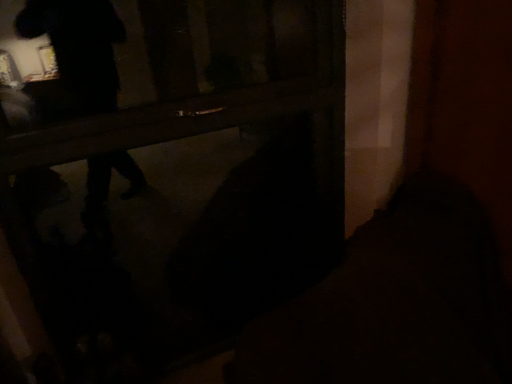
Question: From a real-world perspective, is wooden door at center on black matte bag at lower center?

Choices:
 (A) no
 (B) yes

Answer: (B)

Question: Is wooden door at center positioned with its back to black matte bag at lower center?

Choices:
 (A) no
 (B) yes

Answer: (B)

Question: Is wooden door at center facing towards black matte bag at lower center?

Choices:
 (A) no
 (B) yes

Answer: (B)

Question: From the image's perspective, does wooden door at center appear lower than black matte bag at lower center?

Choices:
 (A) yes
 (B) no

Answer: (B)

Question: Considering the relative sizes of wooden door at center and black matte bag at lower center in the image provided, is wooden door at center smaller than black matte bag at lower center?

Choices:
 (A) no
 (B) yes

Answer: (B)

Question: Does wooden door at center lie in front of black matte bag at lower center?

Choices:
 (A) yes
 (B) no

Answer: (B)

Question: Does black matte bag at lower center have a smaller size compared to wooden door at center?

Choices:
 (A) no
 (B) yes

Answer: (A)

Question: From a real-world perspective, does black matte bag at lower center sit lower than wooden door at center?

Choices:
 (A) no
 (B) yes

Answer: (B)

Question: Would you say black matte bag at lower center is outside wooden door at center?

Choices:
 (A) no
 (B) yes

Answer: (B)

Question: Can you confirm if black matte bag at lower center is positioned to the left of wooden door at center?

Choices:
 (A) no
 (B) yes

Answer: (A)

Question: Can wooden door at center be found inside black matte bag at lower center?

Choices:
 (A) no
 (B) yes

Answer: (A)

Question: Could you tell me if black matte bag at lower center is facing wooden door at center?

Choices:
 (A) no
 (B) yes

Answer: (A)

Question: Is black matte bag at lower center bigger or smaller than wooden door at center?

Choices:
 (A) big
 (B) small

Answer: (A)